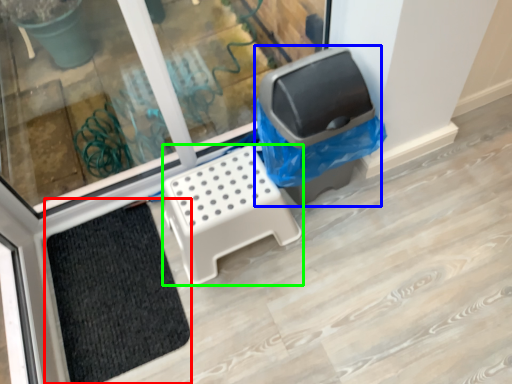
Question: Based on their relative distances, which object is farther from doormat (highlighted by a red box)? Choose from recycling bin (highlighted by a blue box) and furniture (highlighted by a green box).

Choices:
 (A) recycling bin
 (B) furniture

Answer: (A)